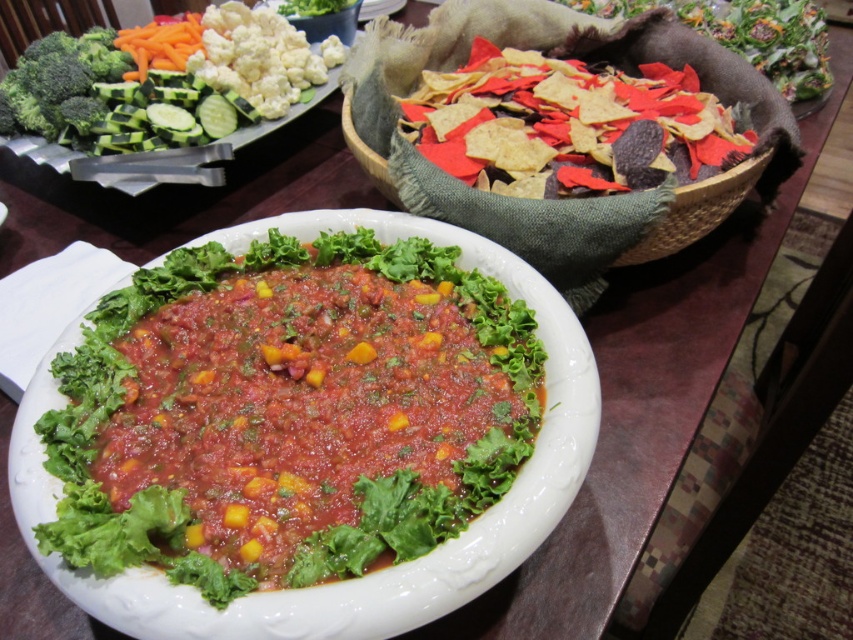
Question: Does tomato-based salsa at center appear on the right side of green leafy vegetable at upper left?

Choices:
 (A) yes
 (B) no

Answer: (A)

Question: Does multicolored tortilla chips at upper right appear on the left side of green matte broccoli at upper left?

Choices:
 (A) yes
 (B) no

Answer: (B)

Question: Which point appears farthest from the camera in this image?

Choices:
 (A) (491, 56)
 (B) (256, 54)
 (C) (813, 65)
 (D) (97, 45)

Answer: (C)

Question: Which object appears closest to the camera in this image?

Choices:
 (A) green zucchini at upper left
 (B) multicolored tortilla chips at upper right

Answer: (B)

Question: Which of the following is the farthest from the observer?

Choices:
 (A) multicolored tortilla chips at upper right
 (B) green leafy vegetable at upper right
 (C) tomato-based salsa at center

Answer: (B)

Question: Is green zucchini at upper left further to the viewer compared to green matte broccoli at upper left?

Choices:
 (A) no
 (B) yes

Answer: (A)